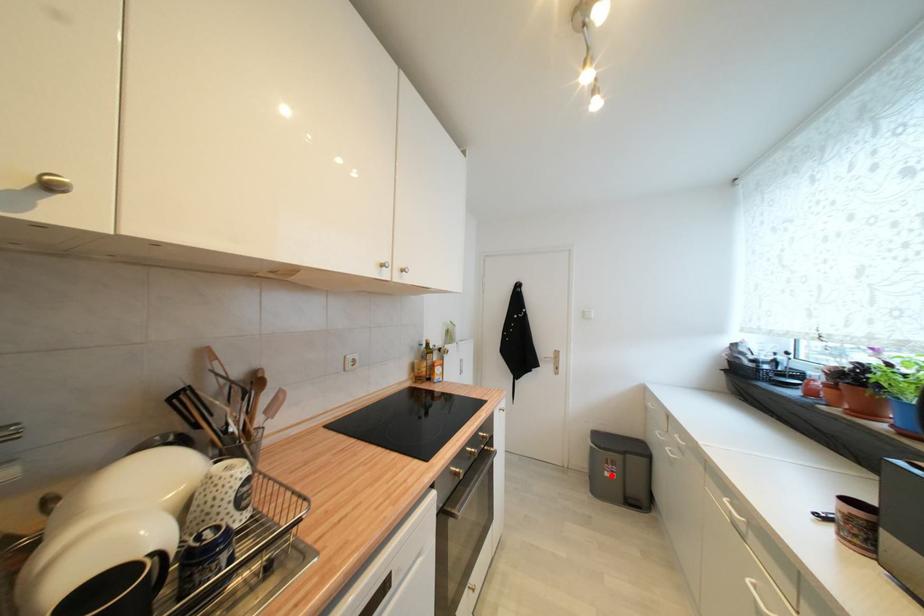
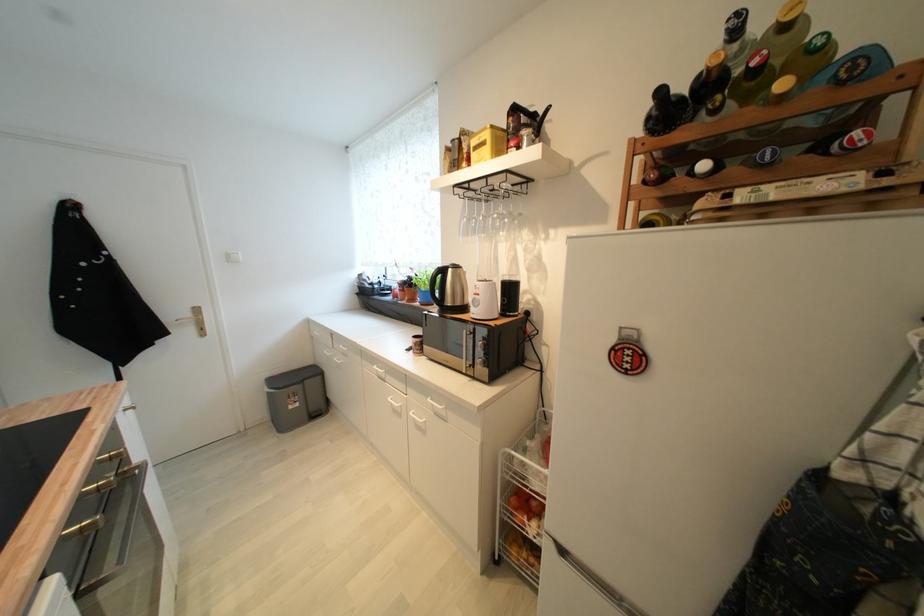
Question: I am providing you with two images of the same scene from different viewpoints. A red point is shown in image1. For the corresponding object point in image2, is it positioned nearer or farther from the camera?

Choices:
 (A) Nearer
 (B) Farther

Answer: (A)